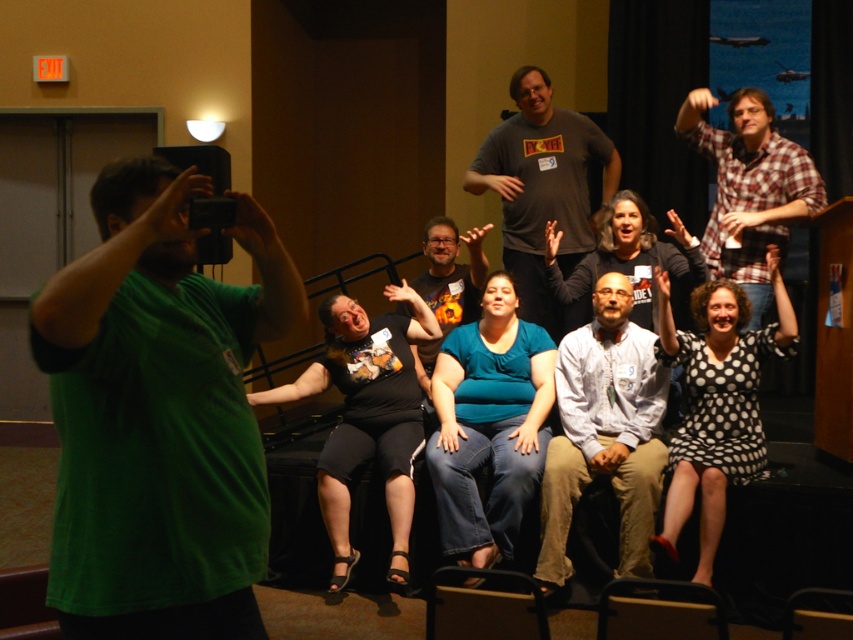
Question: Based on their relative distances, which object is farther from the matte black shirt at center?

Choices:
 (A) plaid flannel shirt at upper right
 (B) black matte shirt at center
 (C) dark gray t-shirt at center

Answer: (A)

Question: Which of the following is the closest to the observer?

Choices:
 (A) (271, 273)
 (B) (634, 374)

Answer: (A)

Question: Is white shirt at center below matte black shirt at center?

Choices:
 (A) no
 (B) yes

Answer: (B)

Question: Does teal matte shirt at center appear on the right side of black dotted dress at center?

Choices:
 (A) no
 (B) yes

Answer: (A)

Question: Which point is farther from the camera taking this photo?

Choices:
 (A) (589, 246)
 (B) (315, 387)
 (C) (639, 554)
 (D) (483, 275)

Answer: (D)

Question: Is teal matte shirt at center behind black matte shirt at center?

Choices:
 (A) yes
 (B) no

Answer: (B)